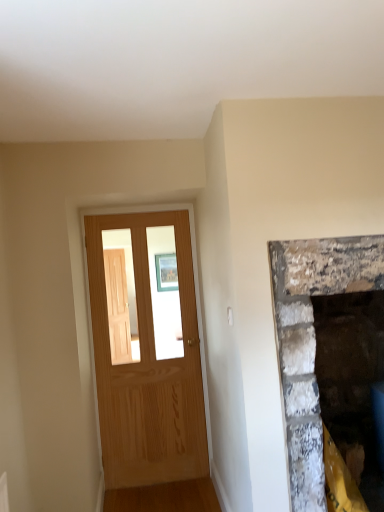
Question: Would you say rough stone fireplace at right contains light brown wood door at left?

Choices:
 (A) yes
 (B) no

Answer: (B)

Question: Can you confirm if rough stone fireplace at right is thinner than light brown wood door at left?

Choices:
 (A) no
 (B) yes

Answer: (A)

Question: Does rough stone fireplace at right have a lesser height compared to light brown wood door at left?

Choices:
 (A) yes
 (B) no

Answer: (A)

Question: Is rough stone fireplace at right outside of light brown wood door at left?

Choices:
 (A) no
 (B) yes

Answer: (B)

Question: Does rough stone fireplace at right turn towards light brown wood door at left?

Choices:
 (A) no
 (B) yes

Answer: (A)

Question: Does rough stone fireplace at right have a greater height compared to light brown wood door at left?

Choices:
 (A) no
 (B) yes

Answer: (A)

Question: Is light brown wood door at left outside rough stone fireplace at right?

Choices:
 (A) yes
 (B) no

Answer: (A)

Question: Can you confirm if light brown wood door at left is wider than rough stone fireplace at right?

Choices:
 (A) no
 (B) yes

Answer: (A)

Question: Is light brown wood door at left turned away from rough stone fireplace at right?

Choices:
 (A) yes
 (B) no

Answer: (B)

Question: Can you confirm if light brown wood door at left is taller than rough stone fireplace at right?

Choices:
 (A) yes
 (B) no

Answer: (A)

Question: Is light brown wood door at left next to rough stone fireplace at right?

Choices:
 (A) yes
 (B) no

Answer: (B)

Question: Is light brown wood door at left thinner than rough stone fireplace at right?

Choices:
 (A) yes
 (B) no

Answer: (A)

Question: From a real-world perspective, is rough stone fireplace at right physically located above or below light brown wood door at left?

Choices:
 (A) above
 (B) below

Answer: (B)